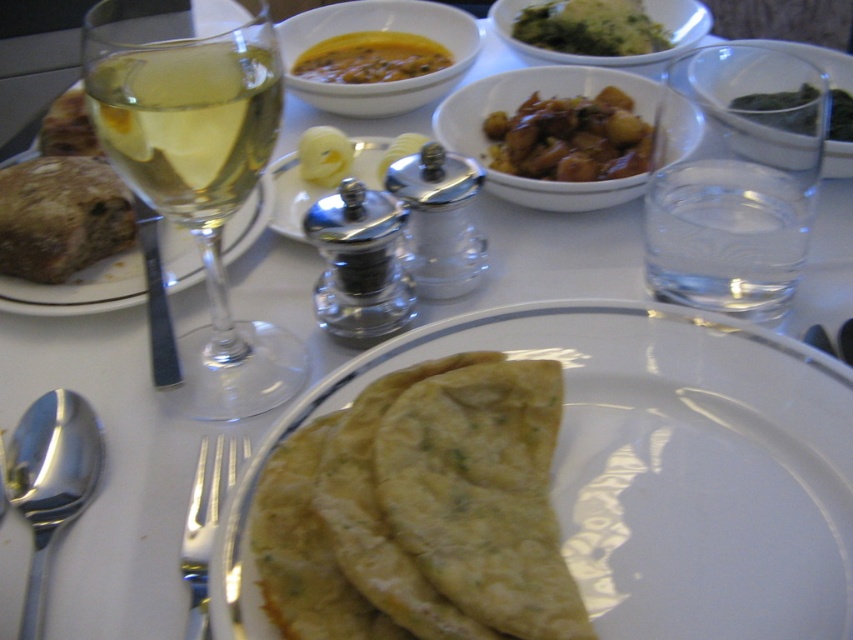
Question: Which point appears closest to the camera in this image?

Choices:
 (A) (376, 58)
 (B) (601, 179)
 (C) (840, 108)
 (D) (350, 504)

Answer: (D)

Question: Is golden brown dough at center closer to camera compared to yellow creamy soup at center?

Choices:
 (A) no
 (B) yes

Answer: (B)

Question: Which is farther from the clear glass wine glass at left?

Choices:
 (A) green leafy vegetable at upper right
 (B) brown matte stew at center

Answer: (A)

Question: Which is nearer to the brown matte stew at center?

Choices:
 (A) golden brown dough at center
 (B) yellow rubber duck at center
 (C) silver metallic fork at lower left
 (D) clear glass wine at upper left

Answer: (B)

Question: Considering the relative positions of silver metallic fork at lower left and yellow creamy soup at center in the image provided, where is silver metallic fork at lower left located with respect to yellow creamy soup at center?

Choices:
 (A) above
 (B) below

Answer: (B)

Question: Does brown matte stew at center appear over green leafy vegetables at center?

Choices:
 (A) yes
 (B) no

Answer: (B)